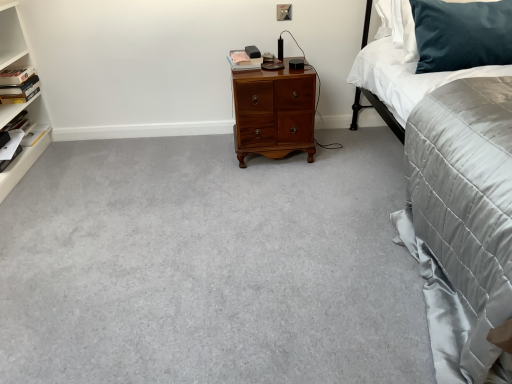
Find the location of a particular element. vacant region to the left of shiny brown wooden nightstand at center is located at coordinates (202, 153).